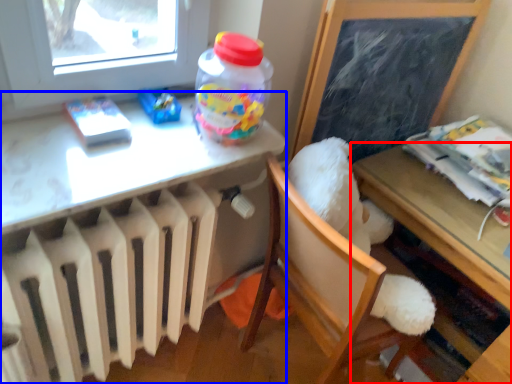
Question: Which point is further to the camera, table (highlighted by a red box) or desk (highlighted by a blue box)?

Choices:
 (A) table
 (B) desk

Answer: (A)